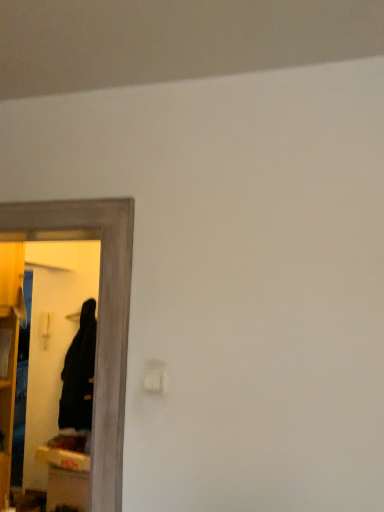
Question: Based on their positions, is black matte robe at left located to the left or right of black matte mirror at left?

Choices:
 (A) right
 (B) left

Answer: (B)

Question: Does point (87, 327) appear closer or farther from the camera than point (122, 379)?

Choices:
 (A) farther
 (B) closer

Answer: (A)

Question: Is black matte robe at left inside or outside of black matte mirror at left?

Choices:
 (A) outside
 (B) inside

Answer: (A)

Question: From the image's perspective, is black matte mirror at left located above or below black matte robe at left?

Choices:
 (A) above
 (B) below

Answer: (A)

Question: From a real-world perspective, is black matte mirror at left physically located above or below black matte robe at left?

Choices:
 (A) below
 (B) above

Answer: (B)

Question: Does point (99, 472) appear closer or farther from the camera than point (86, 335)?

Choices:
 (A) farther
 (B) closer

Answer: (B)

Question: Is black matte mirror at left spatially inside black matte robe at left, or outside of it?

Choices:
 (A) outside
 (B) inside

Answer: (A)